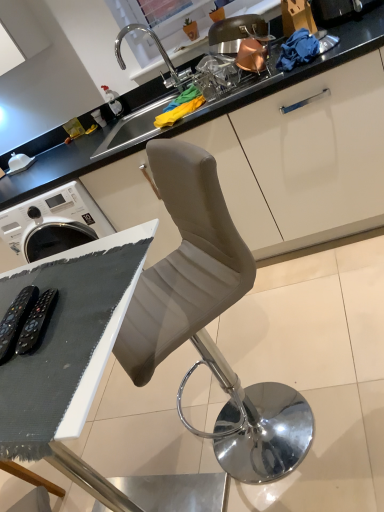
Question: Is matte white cabinet at upper center outside satin nickel sink at upper center?

Choices:
 (A) yes
 (B) no

Answer: (A)

Question: Considering the relative sizes of matte white cabinet at upper center and satin nickel sink at upper center in the image provided, is matte white cabinet at upper center shorter than satin nickel sink at upper center?

Choices:
 (A) yes
 (B) no

Answer: (B)

Question: Can you confirm if matte white cabinet at upper center is positioned to the right of satin nickel sink at upper center?

Choices:
 (A) no
 (B) yes

Answer: (A)

Question: Is matte white cabinet at upper center positioned in front of satin nickel sink at upper center?

Choices:
 (A) yes
 (B) no

Answer: (A)

Question: Can you confirm if matte white cabinet at upper center is wider than satin nickel sink at upper center?

Choices:
 (A) no
 (B) yes

Answer: (B)

Question: Is matte white cabinet at upper center facing towards satin nickel sink at upper center?

Choices:
 (A) yes
 (B) no

Answer: (A)

Question: Considering the relative sizes of matte white cabinet at upper center and white matte table at lower left in the image provided, is matte white cabinet at upper center shorter than white matte table at lower left?

Choices:
 (A) yes
 (B) no

Answer: (B)

Question: Is matte white cabinet at upper center positioned beyond the bounds of white matte table at lower left?

Choices:
 (A) no
 (B) yes

Answer: (B)

Question: Is matte white cabinet at upper center further to the viewer compared to white matte table at lower left?

Choices:
 (A) yes
 (B) no

Answer: (A)

Question: From a real-world perspective, is matte white cabinet at upper center below white matte table at lower left?

Choices:
 (A) yes
 (B) no

Answer: (A)

Question: From a real-world perspective, is matte white cabinet at upper center over white matte table at lower left?

Choices:
 (A) no
 (B) yes

Answer: (A)

Question: Is matte white cabinet at upper center aimed at white matte table at lower left?

Choices:
 (A) yes
 (B) no

Answer: (A)

Question: Considering the relative sizes of satin nickel sink at upper center and suede-like gray chair at center in the image provided, is satin nickel sink at upper center smaller than suede-like gray chair at center?

Choices:
 (A) no
 (B) yes

Answer: (B)